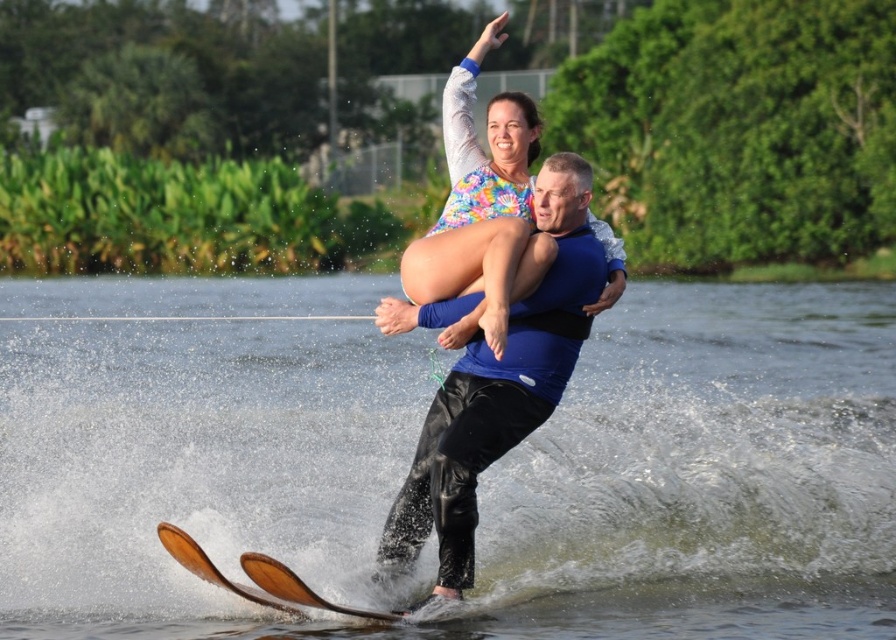
Question: Among these points, which one is nearest to the camera?

Choices:
 (A) (490, 364)
 (B) (100, 451)
 (C) (495, 120)
 (D) (395, 618)

Answer: (D)

Question: Among these objects, which one is farthest from the camera?

Choices:
 (A) clear water at skis center
 (B) tie-dye fabric bikini top at center
 (C) blue matte life vest at center

Answer: (B)

Question: Which point is closer to the camera?

Choices:
 (A) (271, 566)
 (B) (73, 524)

Answer: (A)

Question: Is blue matte life vest at center above brown matte ski at lower center?

Choices:
 (A) no
 (B) yes

Answer: (B)

Question: Is tie-dye fabric bikini top at center closer to the viewer compared to brown wood water ski at lower center?

Choices:
 (A) yes
 (B) no

Answer: (B)

Question: Does clear water at skis center have a greater width compared to blue matte life vest at center?

Choices:
 (A) yes
 (B) no

Answer: (A)